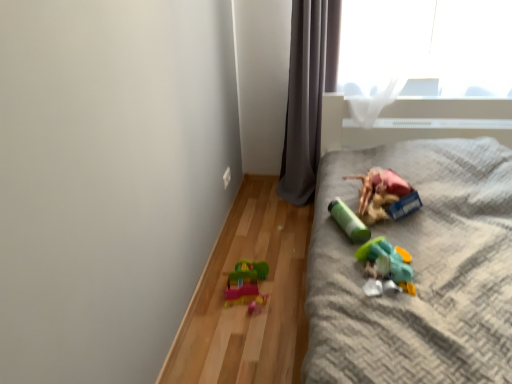
Question: Could you tell me if plastic toy at right is turned towards translucent plastic toy at lower right, marked as the 2th toy in a right-to-left arrangement?

Choices:
 (A) yes
 (B) no

Answer: (B)

Question: Does plastic toy at right contain translucent plastic toy at lower right, marked as the 2th toy in a right-to-left arrangement?

Choices:
 (A) no
 (B) yes

Answer: (B)

Question: Is the depth of plastic toy at right greater than that of translucent plastic toy at lower right, marked as the 2th toy in a right-to-left arrangement?

Choices:
 (A) no
 (B) yes

Answer: (A)

Question: From a real-world perspective, is plastic toy at right physically below translucent plastic toy at lower right, marked as the 2th toy in a right-to-left arrangement?

Choices:
 (A) no
 (B) yes

Answer: (B)

Question: Is plastic toy at right not close to translucent plastic toy at lower right, acting as the 3th toy starting from the left?

Choices:
 (A) no
 (B) yes

Answer: (A)

Question: From the image's perspective, is green matte cylinder at center, the 3th toy when ordered from right to left, positioned above or below gray fabric curtain at upper center?

Choices:
 (A) below
 (B) above

Answer: (A)

Question: From a real-world perspective, is green matte cylinder at center, acting as the 2th toy starting from the left, physically located above or below gray fabric curtain at upper center?

Choices:
 (A) below
 (B) above

Answer: (A)

Question: Would you say green matte cylinder at center, the 3th toy when ordered from right to left, is inside or outside gray fabric curtain at upper center?

Choices:
 (A) inside
 (B) outside

Answer: (B)

Question: Considering the positions of point (356, 228) and point (294, 190), is point (356, 228) closer or farther from the camera than point (294, 190)?

Choices:
 (A) closer
 (B) farther

Answer: (A)

Question: In terms of height, does matte plastic toy at right, the fourth toy positioned from the left, look taller or shorter compared to plastic toy at right?

Choices:
 (A) short
 (B) tall

Answer: (A)

Question: Considering the relative positions of matte plastic toy at right, the fourth toy positioned from the left, and plastic toy at right in the image provided, is matte plastic toy at right, the fourth toy positioned from the left, to the left or to the right of plastic toy at right?

Choices:
 (A) left
 (B) right

Answer: (A)

Question: In the image, is matte plastic toy at right, placed as the 1th toy when sorted from right to left, positioned in front of or behind plastic toy at right?

Choices:
 (A) behind
 (B) front

Answer: (A)

Question: From a real-world perspective, is matte plastic toy at right, placed as the 1th toy when sorted from right to left, positioned above or below plastic toy at right?

Choices:
 (A) below
 (B) above

Answer: (B)

Question: Is matte plastic toy at right, placed as the 1th toy when sorted from right to left, bigger or smaller than green matte cylinder at center, the 3th toy when ordered from right to left?

Choices:
 (A) small
 (B) big

Answer: (B)

Question: Is matte plastic toy at right, the fourth toy positioned from the left, taller or shorter than green matte cylinder at center, the 3th toy when ordered from right to left?

Choices:
 (A) short
 (B) tall

Answer: (B)